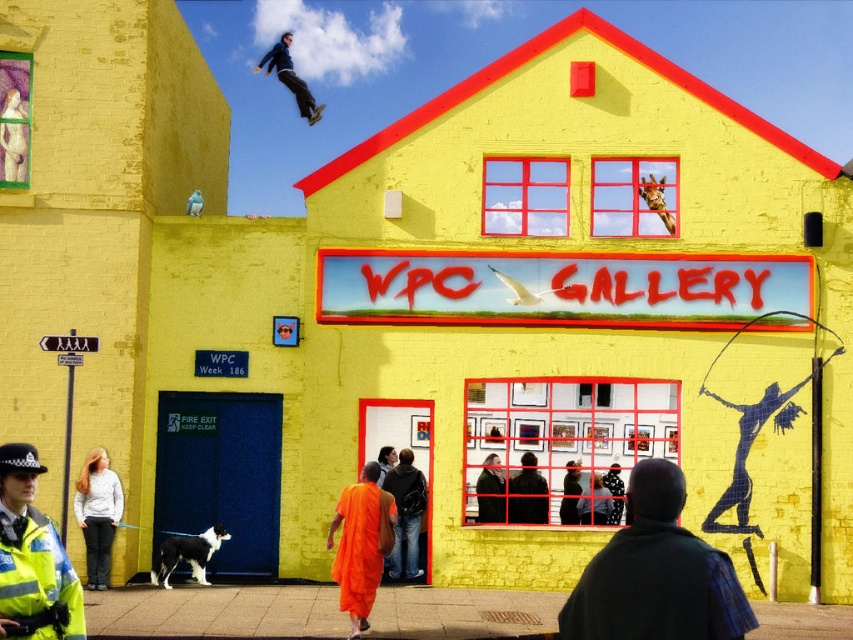
You are a photographer trying to capture a clear shot of the orange fabric man at center without the reflective blue uniform at lower left blocking the view. Can you adjust your position to achieve this?

The reflective blue uniform at lower left is positioned over orange fabric man at center, so moving your camera angle downward or shifting to the right might help avoid the obstruction caused by the reflective blue uniform at lower left.

You are standing in front of the WPC GALLERY and want to reach both the point at coordinates point [733,593] and point [409,483]. Which point should you reach first to minimize the distance walked?

You should reach point [733,593] first because it is closer to you than point [409,483].